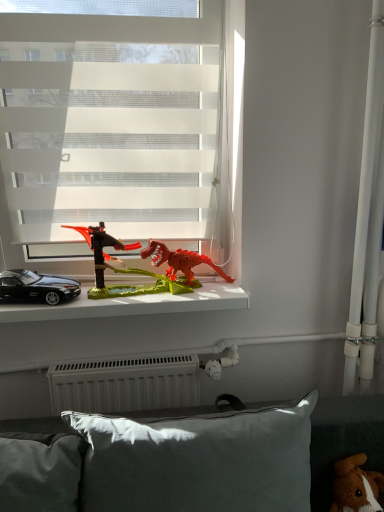
Where is `vacant region under black matte car at left (from a real-world perspective)`? Image resolution: width=384 pixels, height=512 pixels. vacant region under black matte car at left (from a real-world perspective) is located at coordinates (31, 302).